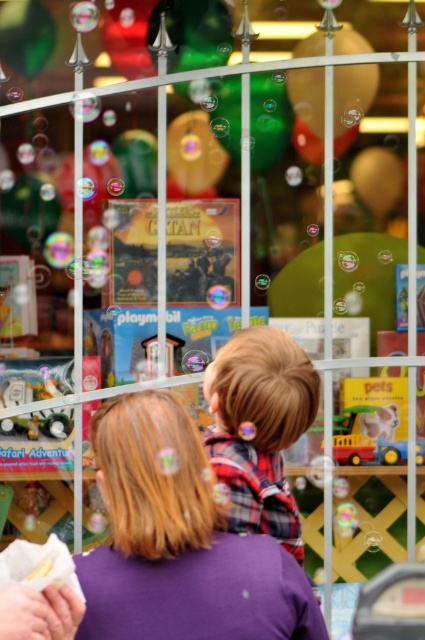
Question: Estimate the real-world distances between objects in this image. Which object is closer to the plaid fabric hair clip at center?

Choices:
 (A) purple fabric at center
 (B) metallic silver watch at left

Answer: (A)

Question: Can you confirm if purple fabric at center is smaller than metallic silver watch at left?

Choices:
 (A) yes
 (B) no

Answer: (B)

Question: Among these points, which one is nearest to the camera?

Choices:
 (A) (336, 74)
 (B) (266, 406)
 (C) (136, 458)
 (D) (36, 376)

Answer: (C)

Question: Is purple fabric at center thinner than plaid fabric hair clip at center?

Choices:
 (A) yes
 (B) no

Answer: (B)

Question: Which point is farther to the camera?

Choices:
 (A) (345, 72)
 (B) (98, 566)
 (C) (44, 419)
 (D) (269, 497)

Answer: (A)

Question: Is purple fabric at center wider than plaid fabric hair clip at center?

Choices:
 (A) no
 (B) yes

Answer: (B)